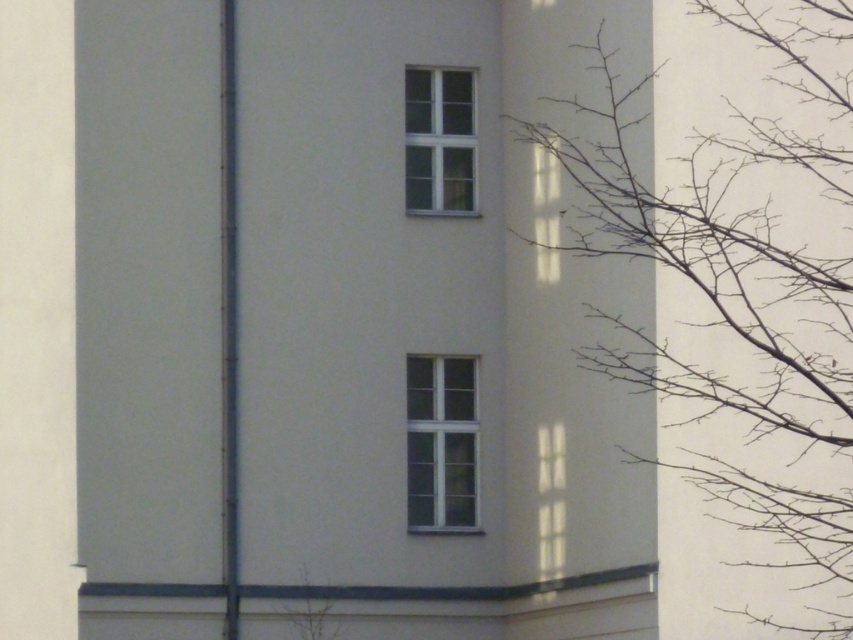
Question: Can you confirm if white smooth wall at center is positioned to the left of bare branches at right?

Choices:
 (A) yes
 (B) no

Answer: (A)

Question: Which point is closer to the camera taking this photo?

Choices:
 (A) (524, 563)
 (B) (415, 179)
 (C) (851, 232)
 (D) (419, 428)

Answer: (C)

Question: Which is nearer to the white plastic window at upper center?

Choices:
 (A) white smooth wall at center
 (B) bare branches at right

Answer: (A)

Question: Which of the following is the farthest from the observer?

Choices:
 (A) (784, 48)
 (B) (433, 461)
 (C) (146, 193)
 (D) (422, 161)

Answer: (D)

Question: In this image, where is bare branches at right located relative to white plastic window at upper center?

Choices:
 (A) above
 (B) below

Answer: (B)

Question: Is bare branches at right closer to camera compared to white plastic window at upper center?

Choices:
 (A) no
 (B) yes

Answer: (B)